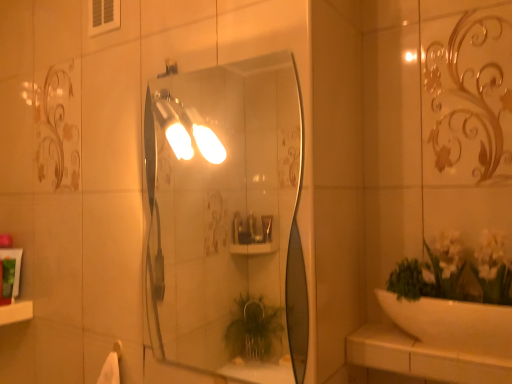
The width and height of the screenshot is (512, 384). What do you see at coordinates (7, 280) in the screenshot?
I see `green matte tube at left, the second toiletry positioned from the back` at bounding box center [7, 280].

From the picture: How much space does green matte tube at left, acting as the second toiletry starting from the front, occupy horizontally?

5.42 centimeters.

Identify the location of white ceramic counter top at lower right. (421, 357).

Describe the element at coordinates (227, 221) in the screenshot. I see `matte glass mirror at center` at that location.

Where is `green matte tube at left, the 1th toiletry in the front-to-back sequence`? This screenshot has width=512, height=384. green matte tube at left, the 1th toiletry in the front-to-back sequence is located at coordinates (7, 280).

Does white glossy ledge at lower left turn towards matte glass mirror at center?

No, white glossy ledge at lower left does not turn towards matte glass mirror at center.

Which is more to the left, white glossy ledge at lower left or matte glass mirror at center?

white glossy ledge at lower left is more to the left.

Which of these two, white glossy ledge at lower left or matte glass mirror at center, stands taller?

matte glass mirror at center.

Considering the positions of objects white glossy ledge at lower left and matte glass mirror at center in the image provided, who is in front, white glossy ledge at lower left or matte glass mirror at center?

matte glass mirror at center is more forward.

Can you confirm if matte silver light fixture at upper center is shorter than white ceramic counter top at lower right?

In fact, matte silver light fixture at upper center may be taller than white ceramic counter top at lower right.

In the image, is matte silver light fixture at upper center on the left side or the right side of white ceramic counter top at lower right?

Clearly, matte silver light fixture at upper center is on the left of white ceramic counter top at lower right in the image.

Which of these two, matte silver light fixture at upper center or white ceramic counter top at lower right, is wider?

white ceramic counter top at lower right is wider.

Where is `counter top lying in front of the matte silver light fixture at upper center`? Image resolution: width=512 pixels, height=384 pixels. counter top lying in front of the matte silver light fixture at upper center is located at coordinates (421, 357).

Between white glossy ledge at lower left and green matte tube at left, acting as the second toiletry starting from the front, which one has larger width?

white glossy ledge at lower left.

From the image's perspective, between white glossy ledge at lower left and green matte tube at left, acting as the second toiletry starting from the front, which one is located above?

green matte tube at left, acting as the second toiletry starting from the front, is shown above in the image.

Could you tell me if white glossy ledge at lower left is turned towards green matte tube at left, acting as the second toiletry starting from the front?

No, white glossy ledge at lower left is not facing towards green matte tube at left, acting as the second toiletry starting from the front.

Does white glossy ledge at lower left appear on the left side of green matte tube at left, marked as the first toiletry in a back-to-front arrangement?

Yes, white glossy ledge at lower left is to the left of green matte tube at left, marked as the first toiletry in a back-to-front arrangement.

From the image's perspective, which one is positioned lower, green matte tube at left, the 1th toiletry in the front-to-back sequence, or matte glass mirror at center?

green matte tube at left, the 1th toiletry in the front-to-back sequence, is shown below in the image.

Consider the image. How different are the orientations of green matte tube at left, the second toiletry positioned from the back, and matte glass mirror at center in degrees?

The facing directions of green matte tube at left, the second toiletry positioned from the back, and matte glass mirror at center are 86.7 degrees apart.

Is point (13, 281) more distant than point (234, 217)?

No.

Is green matte tube at left, acting as the second toiletry starting from the front, facing towards green matte tube at left, the second toiletry positioned from the back?

Yes, green matte tube at left, acting as the second toiletry starting from the front, is facing green matte tube at left, the second toiletry positioned from the back.

Based on their sizes in the image, would you say green matte tube at left, acting as the second toiletry starting from the front, is bigger or smaller than green matte tube at left, the 1th toiletry in the front-to-back sequence?

Considering their sizes, green matte tube at left, acting as the second toiletry starting from the front, takes up more space than green matte tube at left, the 1th toiletry in the front-to-back sequence.

From the image's perspective, which is below, green matte tube at left, acting as the second toiletry starting from the front, or green matte tube at left, the 1th toiletry in the front-to-back sequence?

green matte tube at left, the 1th toiletry in the front-to-back sequence, is shown below in the image.

Considering the positions of objects white glossy ledge at lower left and green matte tube at left, the 1th toiletry in the front-to-back sequence, in the image provided, who is behind, white glossy ledge at lower left or green matte tube at left, the 1th toiletry in the front-to-back sequence,?

Positioned behind is green matte tube at left, the 1th toiletry in the front-to-back sequence.

Does white glossy ledge at lower left appear on the right side of green matte tube at left, the 1th toiletry in the front-to-back sequence?

No, white glossy ledge at lower left is not to the right of green matte tube at left, the 1th toiletry in the front-to-back sequence.

Which of these two, white glossy ledge at lower left or green matte tube at left, the second toiletry positioned from the back, is bigger?

Bigger between the two is white glossy ledge at lower left.

Is white glossy ledge at lower left facing away from green matte tube at left, the second toiletry positioned from the back?

No, white glossy ledge at lower left's orientation is not away from green matte tube at left, the second toiletry positioned from the back.

Is point (384, 332) positioned before point (3, 259)?

That is True.

This screenshot has height=384, width=512. In order to click on counter top on the right of the green matte tube at left, the second toiletry positioned from the back in this screenshot , I will do `click(421, 357)`.

Could you measure the distance between white ceramic counter top at lower right and green matte tube at left, the second toiletry positioned from the back?

A distance of 1.21 meters exists between white ceramic counter top at lower right and green matte tube at left, the second toiletry positioned from the back.

Where is `mirror on the right of white glossy ledge at lower left`? mirror on the right of white glossy ledge at lower left is located at coordinates (227, 221).

Locate an element on the screen. light fixture located above the white ceramic counter top at lower right (from the image's perspective) is located at coordinates (172, 124).

Looking at the image, which one is located closer to white ceramic counter top at lower right, green matte tube at left, acting as the second toiletry starting from the front, or white glossy ledge at lower left?

white glossy ledge at lower left is positioned closer to the anchor white ceramic counter top at lower right.

Considering their positions, is white glossy ledge at lower left positioned closer to green matte tube at left, acting as the second toiletry starting from the front, than green matte tube at left, the 1th toiletry in the front-to-back sequence?

The object closer to green matte tube at left, acting as the second toiletry starting from the front, is green matte tube at left, the 1th toiletry in the front-to-back sequence.

From the image, which object appears to be farther from green matte tube at left, the second toiletry positioned from the back, matte glass mirror at center or green matte tube at left, marked as the first toiletry in a back-to-front arrangement?

Based on the image, matte glass mirror at center appears to be further to green matte tube at left, the second toiletry positioned from the back.

Considering their positions, is white glossy ledge at lower left positioned further to matte glass mirror at center than green matte tube at left, marked as the first toiletry in a back-to-front arrangement?

Among the two, white glossy ledge at lower left is located further to matte glass mirror at center.

Estimate the real-world distances between objects in this image. Which object is closer to green matte tube at left, the second toiletry positioned from the back, matte glass mirror at center or matte silver light fixture at upper center?

The object closer to green matte tube at left, the second toiletry positioned from the back, is matte silver light fixture at upper center.

Which object lies further to the anchor point green matte tube at left, the 1th toiletry in the front-to-back sequence, matte glass mirror at center or white glossy ledge at lower left?

matte glass mirror at center is positioned further to the anchor green matte tube at left, the 1th toiletry in the front-to-back sequence.

Based on their spatial positions, is white glossy ledge at lower left or matte silver light fixture at upper center further from white ceramic counter top at lower right?

Based on the image, white glossy ledge at lower left appears to be further to white ceramic counter top at lower right.

When comparing their distances from green matte tube at left, acting as the second toiletry starting from the front, does white ceramic counter top at lower right or green matte tube at left, the 1th toiletry in the front-to-back sequence, seem closer?

green matte tube at left, the 1th toiletry in the front-to-back sequence, is closer to green matte tube at left, acting as the second toiletry starting from the front.

Find the location of a particular element. The image size is (512, 384). mirror between white glossy ledge at lower left and white ceramic counter top at lower right is located at coordinates (227, 221).

Identify the location of toiletry located between green matte tube at left, marked as the first toiletry in a back-to-front arrangement, and matte glass mirror at center in the left-right direction. (7, 280).

Where is `light fixture between green matte tube at left, acting as the second toiletry starting from the front, and matte glass mirror at center from left to right`? The image size is (512, 384). light fixture between green matte tube at left, acting as the second toiletry starting from the front, and matte glass mirror at center from left to right is located at coordinates (172, 124).

Where is `mirror between green matte tube at left, acting as the second toiletry starting from the front, and white ceramic counter top at lower right from left to right`? mirror between green matte tube at left, acting as the second toiletry starting from the front, and white ceramic counter top at lower right from left to right is located at coordinates (227, 221).